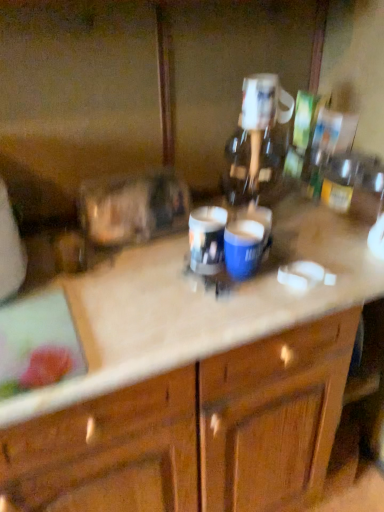
What is the approximate height of matte plastic cup at center, which is counted as the 1th beverage, starting from the left?

matte plastic cup at center, which is counted as the 1th beverage, starting from the left, is 4.74 inches in height.

Where is `blue glossy mug at center, which is the first beverage in right-to-left order`? This screenshot has width=384, height=512. blue glossy mug at center, which is the first beverage in right-to-left order is located at coordinates (243, 248).

Locate an element on the screen. matte plastic cup at center, arranged as the second beverage when viewed from the right is located at coordinates (207, 239).

From the image's perspective, relative to blue glossy mug at center, which is the first beverage in right-to-left order, is matte plastic cup at center, arranged as the second beverage when viewed from the right, above or below?

Based on their image positions, matte plastic cup at center, arranged as the second beverage when viewed from the right, is located above blue glossy mug at center, which is the first beverage in right-to-left order.

In the image, is matte plastic cup at center, which is counted as the 1th beverage, starting from the left, on the left side or the right side of blue glossy mug at center, the 2th beverage from the left?

matte plastic cup at center, which is counted as the 1th beverage, starting from the left, is positioned on blue glossy mug at center, the 2th beverage from the left,'s left side.

Consider the image. How distant is matte plastic cup at center, which is counted as the 1th beverage, starting from the left, from blue glossy mug at center, the 2th beverage from the left?

matte plastic cup at center, which is counted as the 1th beverage, starting from the left, and blue glossy mug at center, the 2th beverage from the left, are 2.58 inches apart.

Which object is thinner, matte plastic cup at center, which is counted as the 1th beverage, starting from the left, or blue glossy mug at center, which is the first beverage in right-to-left order?

blue glossy mug at center, which is the first beverage in right-to-left order, is thinner.

Are matte plastic cup at center, which is counted as the 1th beverage, starting from the left, and beige marble countertop at center making contact?

There is a gap between matte plastic cup at center, which is counted as the 1th beverage, starting from the left, and beige marble countertop at center.

Is matte plastic cup at center, arranged as the second beverage when viewed from the right, taller than beige marble countertop at center?

No.

Is the depth of matte plastic cup at center, arranged as the second beverage when viewed from the right, greater than that of beige marble countertop at center?

Yes, matte plastic cup at center, arranged as the second beverage when viewed from the right, is further from the viewer.

Considering the relative sizes of blue glossy mug at center, which is the first beverage in right-to-left order, and matte plastic cup at center, arranged as the second beverage when viewed from the right, in the image provided, is blue glossy mug at center, which is the first beverage in right-to-left order, bigger than matte plastic cup at center, arranged as the second beverage when viewed from the right,?

No.

Is blue glossy mug at center, which is the first beverage in right-to-left order, closer to the viewer compared to matte plastic cup at center, which is counted as the 1th beverage, starting from the left?

That is True.

From a real-world perspective, is blue glossy mug at center, the 2th beverage from the left, positioned under matte plastic cup at center, arranged as the second beverage when viewed from the right, based on gravity?

Yes, from a real-world perspective, blue glossy mug at center, the 2th beverage from the left, is beneath matte plastic cup at center, arranged as the second beverage when viewed from the right.

Does blue glossy mug at center, which is the first beverage in right-to-left order, contain matte plastic cup at center, arranged as the second beverage when viewed from the right?

That's incorrect, matte plastic cup at center, arranged as the second beverage when viewed from the right, is not inside blue glossy mug at center, which is the first beverage in right-to-left order.

Is beige marble countertop at center at the right side of blue glossy mug at center, the 2th beverage from the left?

Incorrect, beige marble countertop at center is not on the right side of blue glossy mug at center, the 2th beverage from the left.

Considering the relative sizes of beige marble countertop at center and blue glossy mug at center, the 2th beverage from the left, in the image provided, is beige marble countertop at center shorter than blue glossy mug at center, the 2th beverage from the left,?

In fact, beige marble countertop at center may be taller than blue glossy mug at center, the 2th beverage from the left.

Where is `counter top below the blue glossy mug at center, the 2th beverage from the left (from the image's perspective)`? The image size is (384, 512). counter top below the blue glossy mug at center, the 2th beverage from the left (from the image's perspective) is located at coordinates (174, 310).

Is blue glossy mug at center, which is the first beverage in right-to-left order, oriented away from beige marble countertop at center?

blue glossy mug at center, which is the first beverage in right-to-left order, is not turned away from beige marble countertop at center.

Based on the photo, from a real-world perspective, relative to beige marble countertop at center, is blue glossy mug at center, which is the first beverage in right-to-left order, vertically above or below?

From a real-world perspective, blue glossy mug at center, which is the first beverage in right-to-left order, is physically above beige marble countertop at center.

Can beige marble countertop at center be found inside blue glossy mug at center, the 2th beverage from the left?

Definitely not — beige marble countertop at center is not inside blue glossy mug at center, the 2th beverage from the left.

Is blue glossy mug at center, the 2th beverage from the left, at the left side of beige marble countertop at center?

In fact, blue glossy mug at center, the 2th beverage from the left, is to the right of beige marble countertop at center.

Choose the correct answer: Is beige marble countertop at center inside matte plastic cup at center, arranged as the second beverage when viewed from the right, or outside it?

beige marble countertop at center is located beyond the bounds of matte plastic cup at center, arranged as the second beverage when viewed from the right.

Consider the image. In the image, is beige marble countertop at center positioned in front of or behind matte plastic cup at center, which is counted as the 1th beverage, starting from the left?

Visually, beige marble countertop at center is located in front of matte plastic cup at center, which is counted as the 1th beverage, starting from the left.

Can you tell me how much beige marble countertop at center and matte plastic cup at center, arranged as the second beverage when viewed from the right, differ in facing direction?

The facing directions of beige marble countertop at center and matte plastic cup at center, arranged as the second beverage when viewed from the right, are 1.14 degrees apart.

From a real-world perspective, is beige marble countertop at center below matte plastic cup at center, arranged as the second beverage when viewed from the right?

Yes.

Locate an element on the screen. beverage lying on the right of matte plastic cup at center, which is counted as the 1th beverage, starting from the left is located at coordinates tap(243, 248).

Locate an element on the screen. This screenshot has height=512, width=384. counter top below the matte plastic cup at center, which is counted as the 1th beverage, starting from the left (from the image's perspective) is located at coordinates tap(174, 310).

From the image, which object appears to be nearer to beige marble countertop at center, matte plastic cup at center, arranged as the second beverage when viewed from the right, or blue glossy mug at center, the 2th beverage from the left?

Based on the image, matte plastic cup at center, arranged as the second beverage when viewed from the right, appears to be nearer to beige marble countertop at center.

Based on their spatial positions, is matte plastic cup at center, which is counted as the 1th beverage, starting from the left, or beige marble countertop at center further from blue glossy mug at center, the 2th beverage from the left?

beige marble countertop at center.

Looking at the image, which one is located closer to blue glossy mug at center, which is the first beverage in right-to-left order, beige marble countertop at center or matte plastic cup at center, which is counted as the 1th beverage, starting from the left?

Among the two, matte plastic cup at center, which is counted as the 1th beverage, starting from the left, is located nearer to blue glossy mug at center, which is the first beverage in right-to-left order.

Which object lies nearer to the anchor point matte plastic cup at center, which is counted as the 1th beverage, starting from the left, beige marble countertop at center or blue glossy mug at center, which is the first beverage in right-to-left order?

The object closer to matte plastic cup at center, which is counted as the 1th beverage, starting from the left, is blue glossy mug at center, which is the first beverage in right-to-left order.

Considering their positions, is blue glossy mug at center, the 2th beverage from the left, positioned further to beige marble countertop at center than matte plastic cup at center, arranged as the second beverage when viewed from the right?

blue glossy mug at center, the 2th beverage from the left.

From the image, which object appears to be farther from matte plastic cup at center, arranged as the second beverage when viewed from the right, blue glossy mug at center, which is the first beverage in right-to-left order, or beige marble countertop at center?

Based on the image, beige marble countertop at center appears to be further to matte plastic cup at center, arranged as the second beverage when viewed from the right.

Find the location of a particular element. beverage between matte plastic cup at center, arranged as the second beverage when viewed from the right, and beige marble countertop at center in the up-down direction is located at coordinates pos(243,248).